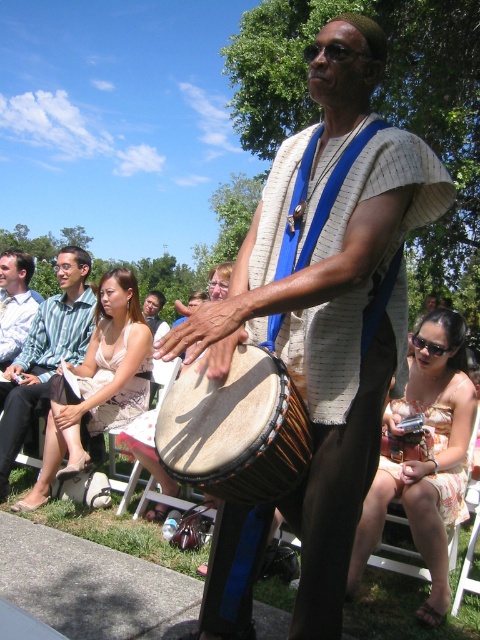
In the scene shown: Can you confirm if matte brown drum at center is shorter than matte white dress at center?

No.

Measure the distance between matte brown drum at center and matte white dress at center.

They are 6.53 meters apart.

Locate an element on the screen. The height and width of the screenshot is (640, 480). matte brown drum at center is located at coordinates (330, 296).

Which is above, matte brown drum at center or natural wood drum at center?

matte brown drum at center is above.

Is point (208, 600) farther from viewer compared to point (239, 476)?

Yes, point (208, 600) is farther from viewer.

In order to click on matte brown drum at center in this screenshot , I will do `click(330, 296)`.

Which is in front, point (47, 301) or point (145, 312)?

Positioned in front is point (47, 301).

Find the location of a particular element. green fabric dress at left is located at coordinates (46, 355).

Locate an element on the screen. green fabric dress at left is located at coordinates (46, 355).

Locate an element on the screen. green fabric dress at left is located at coordinates (46, 355).